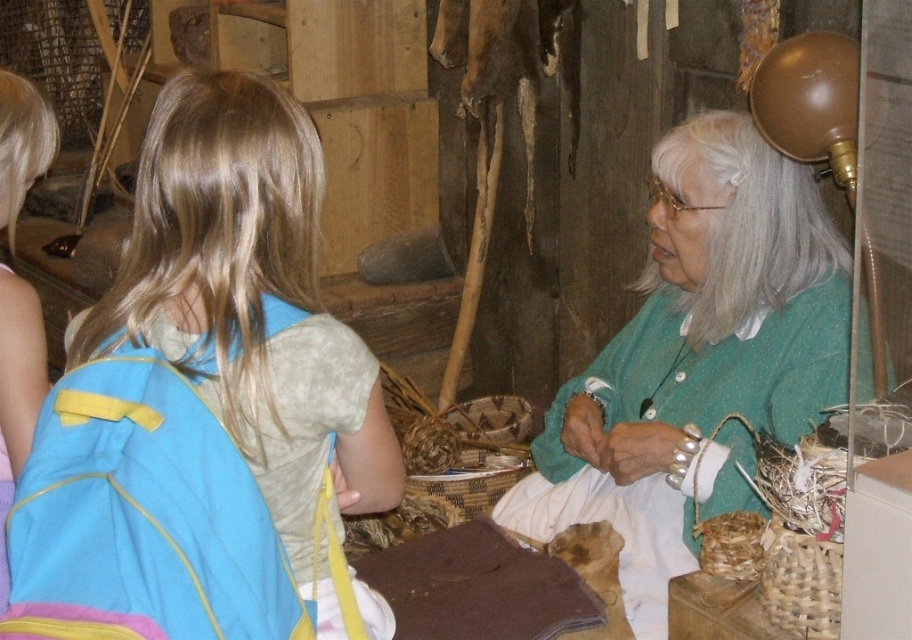
Can you confirm if green knitted sweater at upper right is thinner than blue fabric backpack at left?

No.

Is green knitted sweater at upper right below blue fabric backpack at left?

No, green knitted sweater at upper right is not below blue fabric backpack at left.

Locate an element on the screen. green knitted sweater at upper right is located at coordinates (697, 358).